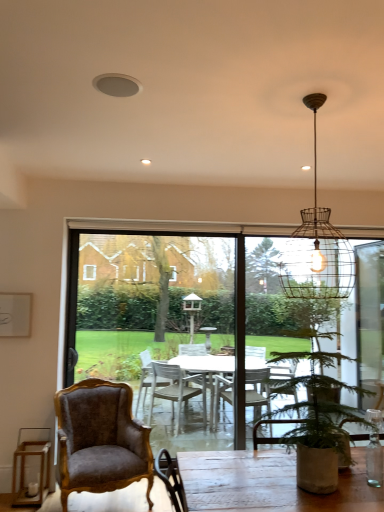
Question: Considering the relative positions of wire mesh pendant light at upper center and velvet brown armchair at lower left in the image provided, is wire mesh pendant light at upper center to the right of velvet brown armchair at lower left from the viewer's perspective?

Choices:
 (A) yes
 (B) no

Answer: (A)

Question: Does wire mesh pendant light at upper center have a greater height compared to velvet brown armchair at lower left?

Choices:
 (A) yes
 (B) no

Answer: (A)

Question: Does wire mesh pendant light at upper center have a smaller size compared to velvet brown armchair at lower left?

Choices:
 (A) yes
 (B) no

Answer: (A)

Question: Does wire mesh pendant light at upper center appear on the left side of velvet brown armchair at lower left?

Choices:
 (A) no
 (B) yes

Answer: (A)

Question: Considering the relative sizes of wire mesh pendant light at upper center and velvet brown armchair at lower left in the image provided, is wire mesh pendant light at upper center shorter than velvet brown armchair at lower left?

Choices:
 (A) no
 (B) yes

Answer: (A)

Question: Looking at the image, does transparent glass table at center seem bigger or smaller compared to green leafy plant in pot at lower right?

Choices:
 (A) big
 (B) small

Answer: (A)

Question: Is transparent glass table at center inside the boundaries of green leafy plant in pot at lower right, or outside?

Choices:
 (A) inside
 (B) outside

Answer: (B)

Question: From the image's perspective, is transparent glass table at center positioned above or below green leafy plant in pot at lower right?

Choices:
 (A) above
 (B) below

Answer: (B)

Question: In the image, is transparent glass table at center positioned in front of or behind green leafy plant in pot at lower right?

Choices:
 (A) behind
 (B) front

Answer: (A)

Question: Considering their positions, is velvet brown armchair at lower left located in front of or behind green leafy plant in pot at lower right?

Choices:
 (A) front
 (B) behind

Answer: (B)

Question: Based on their sizes in the image, would you say velvet brown armchair at lower left is bigger or smaller than green leafy plant in pot at lower right?

Choices:
 (A) small
 (B) big

Answer: (B)

Question: Considering the positions of velvet brown armchair at lower left and green leafy plant in pot at lower right in the image, is velvet brown armchair at lower left taller or shorter than green leafy plant in pot at lower right?

Choices:
 (A) tall
 (B) short

Answer: (A)

Question: Is velvet brown armchair at lower left wider or thinner than green leafy plant in pot at lower right?

Choices:
 (A) thin
 (B) wide

Answer: (B)

Question: Is wire mesh pendant light at upper center inside the boundaries of green leafy plant in pot at lower right, or outside?

Choices:
 (A) outside
 (B) inside

Answer: (A)

Question: Is point (334, 276) closer or farther from the camera than point (331, 425)?

Choices:
 (A) farther
 (B) closer

Answer: (A)